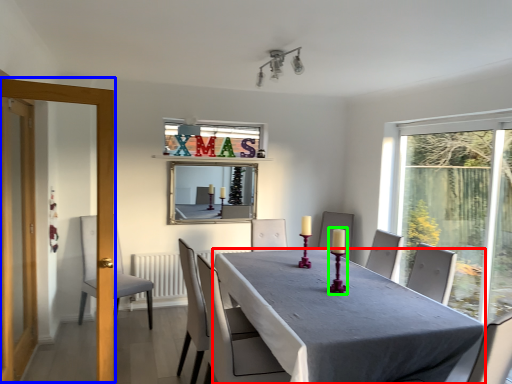
Question: Which object is positioned closest to table (highlighted by a red box)? Select from screen door (highlighted by a blue box) and candle holder (highlighted by a green box).

Choices:
 (A) screen door
 (B) candle holder

Answer: (B)